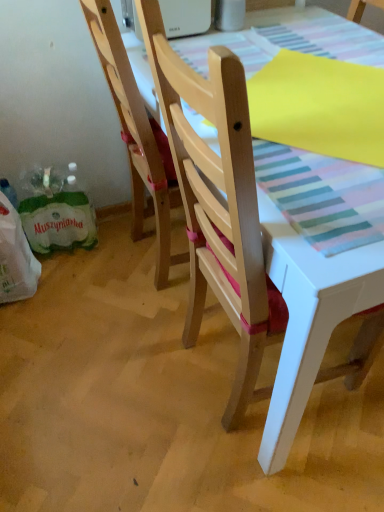
Where is `vacant area that lies between natural wood chair at center, arranged as the second chair when viewed from the right, and green plastic grocery bag at lower left`? The width and height of the screenshot is (384, 512). vacant area that lies between natural wood chair at center, arranged as the second chair when viewed from the right, and green plastic grocery bag at lower left is located at coordinates (84, 276).